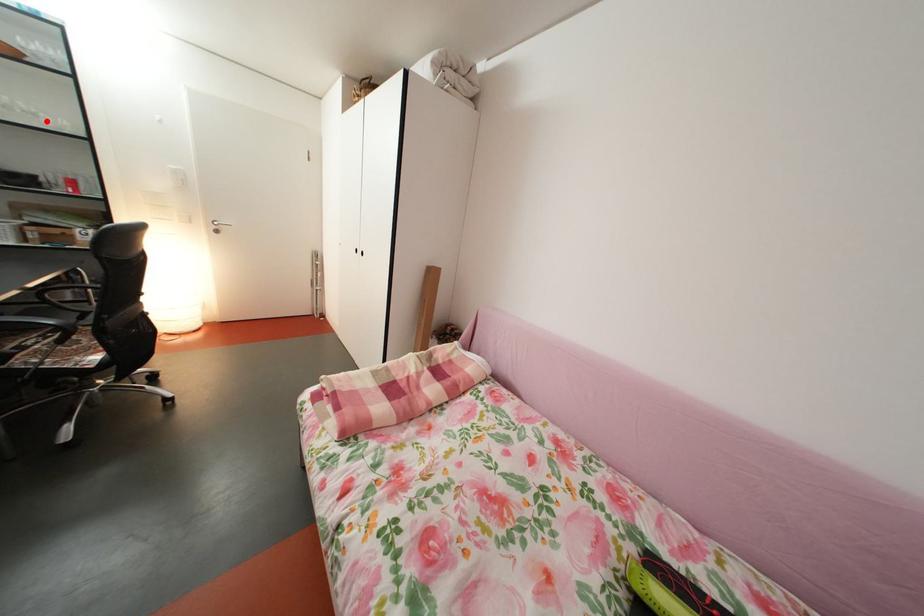
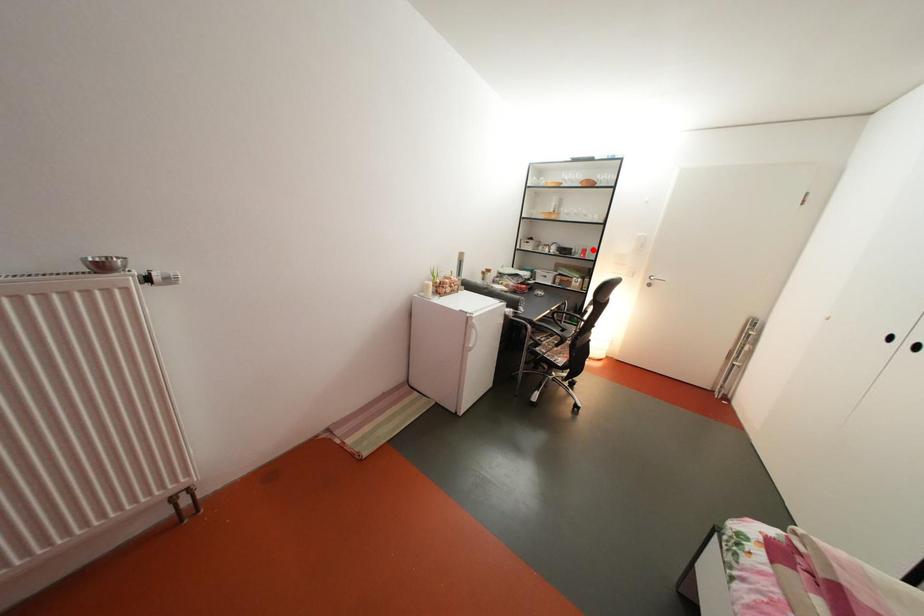
From the picture: I am providing you with two images of the same scene from different viewpoints. A red point is marked on the first image and another point is marked on the second image. Are the points marked in image1 and image2 representing the same 3D position?

No